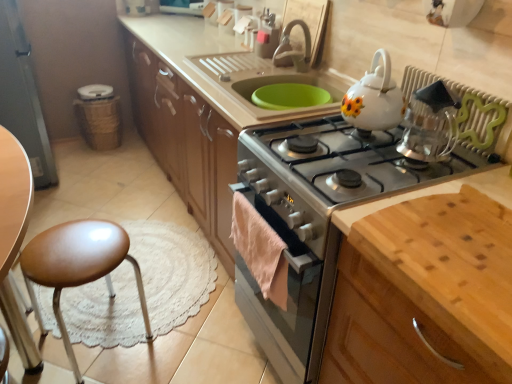
Locate an element on the screen. This screenshot has height=384, width=512. free spot to the right of brown leather stool at lower left is located at coordinates (183, 328).